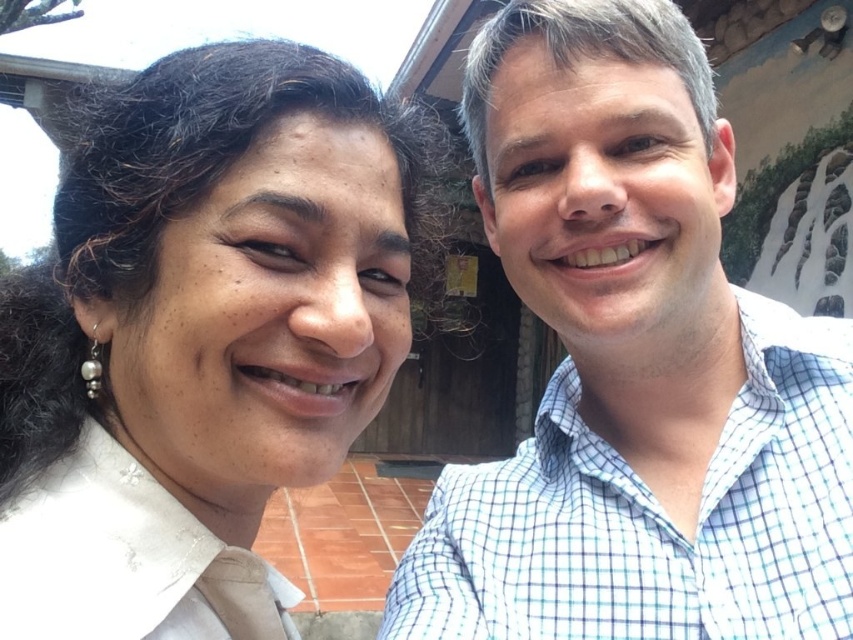
Does white checkered shirt at right have a larger size compared to white matte shirt at upper left?

Correct, white checkered shirt at right is larger in size than white matte shirt at upper left.

Is white checkered shirt at right wider than white matte shirt at upper left?

Yes, white checkered shirt at right is wider than white matte shirt at upper left.

What do you see at coordinates (634, 365) in the screenshot? I see `white checkered shirt at right` at bounding box center [634, 365].

The width and height of the screenshot is (853, 640). What are the coordinates of `white checkered shirt at right` in the screenshot? It's located at (634, 365).